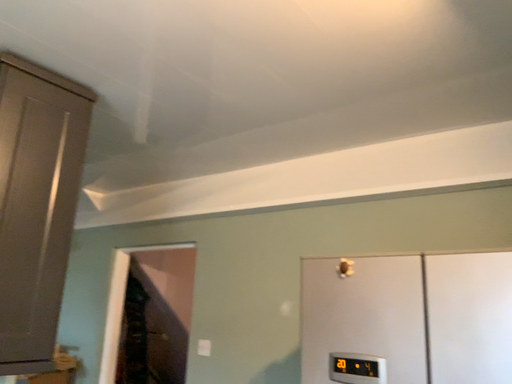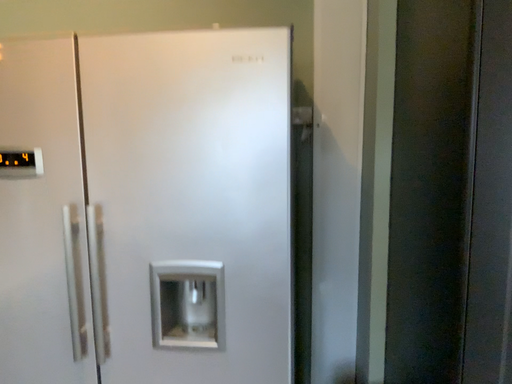
Question: How did the camera likely rotate when shooting the video?

Choices:
 (A) rotated right
 (B) rotated left

Answer: (A)